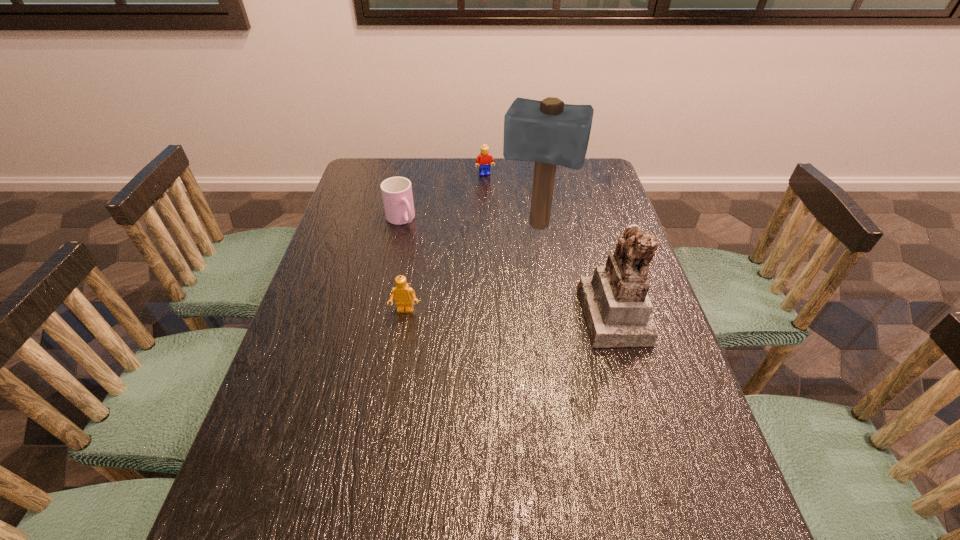
Identify the location of vacant space located on the striking surface of the mallet. This screenshot has height=540, width=960. (525, 256).

Where is `vacant point located 0.230m on the striking surface of the mallet`? This screenshot has height=540, width=960. vacant point located 0.230m on the striking surface of the mallet is located at coordinates (512, 298).

Identify the location of free space located 0.100m on the striking surface of the mallet. (522, 266).

This screenshot has height=540, width=960. What are the coordinates of `vacant area situated 0.360m with the handle on the side of the cup` in the screenshot? It's located at (468, 303).

Where is `free region located 0.080m with the handle on the side of the cup`? The height and width of the screenshot is (540, 960). free region located 0.080m with the handle on the side of the cup is located at coordinates (419, 244).

Where is `vacant space located 0.210m with the handle on the side of the cup`? The width and height of the screenshot is (960, 540). vacant space located 0.210m with the handle on the side of the cup is located at coordinates (440, 269).

You are a GUI agent. You are given a task and a screenshot of the screen. Output one action in this format:
    pyautogui.click(x=<x>, y=<y>)
    Task: Click on the object present at the far edge
    The image size is (960, 540).
    Given the screenshot: What is the action you would take?
    tap(484, 157)

Where is `object positioned at the left edge`? object positioned at the left edge is located at coordinates (397, 195).

The height and width of the screenshot is (540, 960). In order to click on figurine situated at the right edge in this screenshot , I will do `click(617, 310)`.

You are a GUI agent. You are given a task and a screenshot of the screen. Output one action in this format:
    pyautogui.click(x=<x>, y=<y>)
    Task: Click on the mallet located in the right edge section of the desktop
    
    Given the screenshot: What is the action you would take?
    pyautogui.click(x=548, y=132)